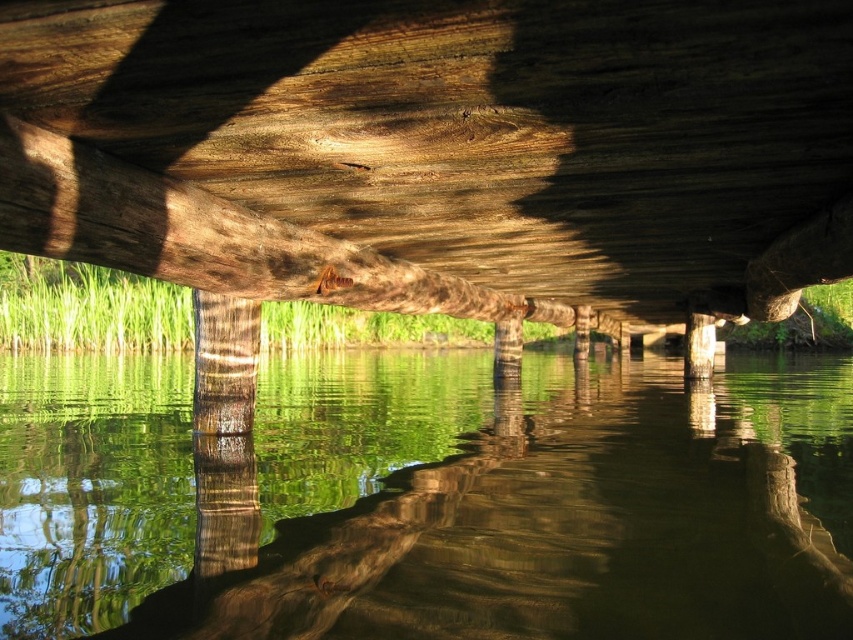
You are a photographer aiming to capture the wooden beam at center and the green reflective water at center in your shot. Which object appears taller in the frame?

The wooden beam at center appears taller than the green reflective water at center in the frame.

You are standing on the wooden bridge and looking down at the water. Which object is closer to you, the green reflective water at center or the smooth brown tree trunk at center?

The smooth brown tree trunk at center is closer to you because it is above the green reflective water at center, which is located below it.